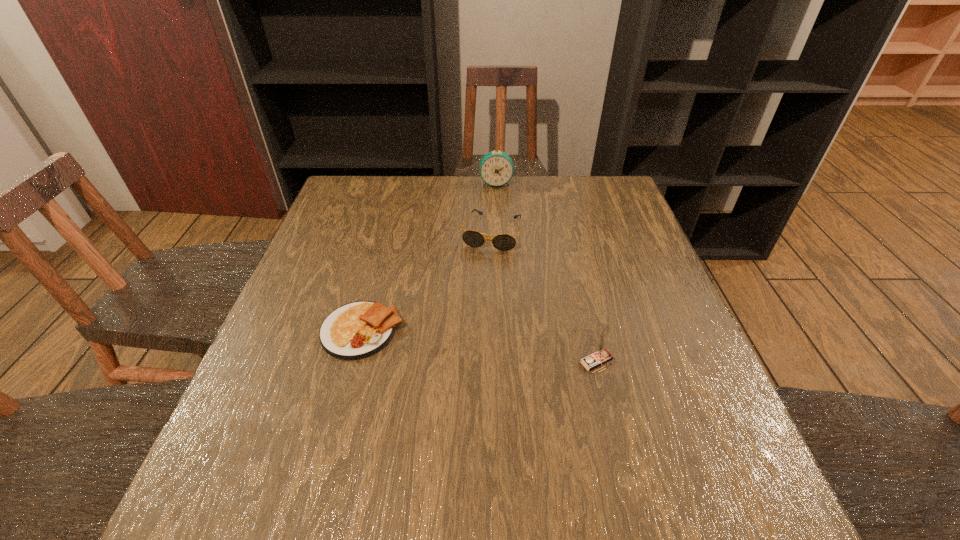
Locate an element on the screen. vacant space located 0.270m on the front-facing side of the sunglasses is located at coordinates (464, 326).

Identify the location of free space located 0.370m on the front-facing side of the farthest object. (498, 262).

I want to click on vacant area situated on the front-facing side of the farthest object, so click(x=496, y=218).

The width and height of the screenshot is (960, 540). I want to click on vacant region located on the front-facing side of the farthest object, so click(x=497, y=248).

Find the location of a particular element. Image resolution: width=960 pixels, height=540 pixels. sunglasses that is positioned at the far edge is located at coordinates (503, 242).

I want to click on alarm clock positioned at the far edge, so click(496, 168).

The image size is (960, 540). In order to click on object present at the left edge in this screenshot , I will do `click(357, 330)`.

The image size is (960, 540). Identify the location of vacant area at the far edge of the desktop. (559, 208).

The height and width of the screenshot is (540, 960). I want to click on vacant space at the near edge, so click(x=339, y=434).

Locate an element on the screen. vacant space at the left edge of the desktop is located at coordinates (344, 248).